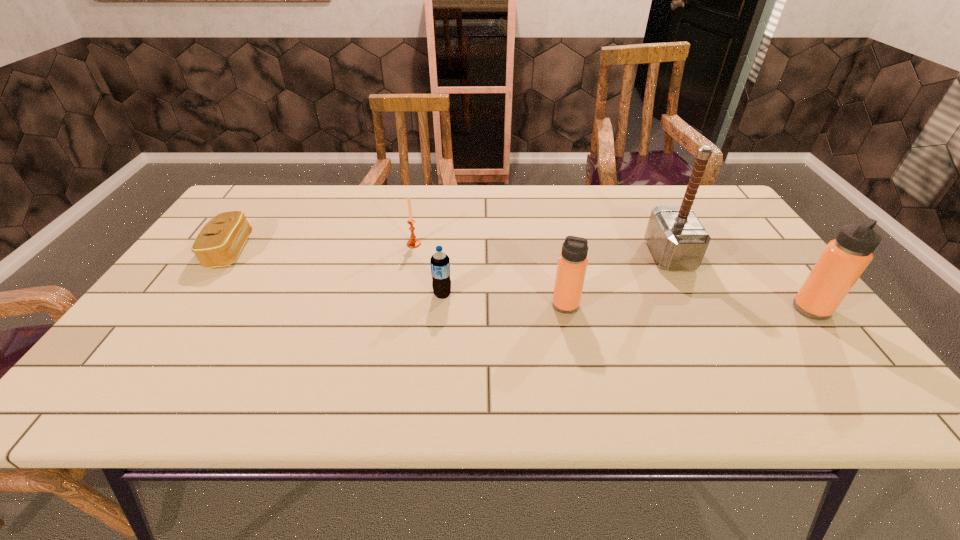
At what (x,y) coordinates should I click in order to perform the action: click on the shorter thermos bottle. Please return your answer as a coordinate pair (x, y). This screenshot has height=540, width=960. Looking at the image, I should click on (572, 264).

You are a GUI agent. You are given a task and a screenshot of the screen. Output one action in this format:
    pyautogui.click(x=<x>, y=<y>)
    Task: Click on the fourth object from left to right
    The height and width of the screenshot is (540, 960).
    Given the screenshot: What is the action you would take?
    pyautogui.click(x=572, y=264)

The image size is (960, 540). Find the location of `the taller thermos bottle`. the taller thermos bottle is located at coordinates 845,258.

This screenshot has width=960, height=540. I want to click on the second tallest object, so click(x=845, y=258).

Where is `the fifth object from right to left`? This screenshot has height=540, width=960. the fifth object from right to left is located at coordinates tap(412, 243).

Identify the location of the tallest object. (678, 241).

At what (x,y) coordinates should I click in order to perform the action: click on the second object from right to left. Please return your answer as a coordinate pair (x, y). Looking at the image, I should click on (678, 241).

Find the location of `the shortest object`. the shortest object is located at coordinates (218, 244).

Where is `clutch bag`? clutch bag is located at coordinates (218, 244).

Where is `the fourth object from right to left`? This screenshot has height=540, width=960. the fourth object from right to left is located at coordinates (440, 262).